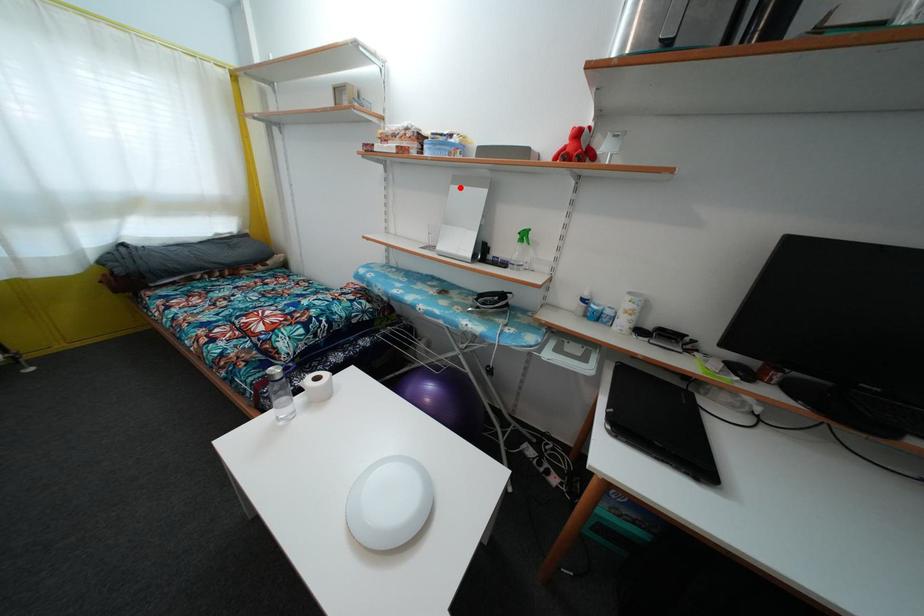
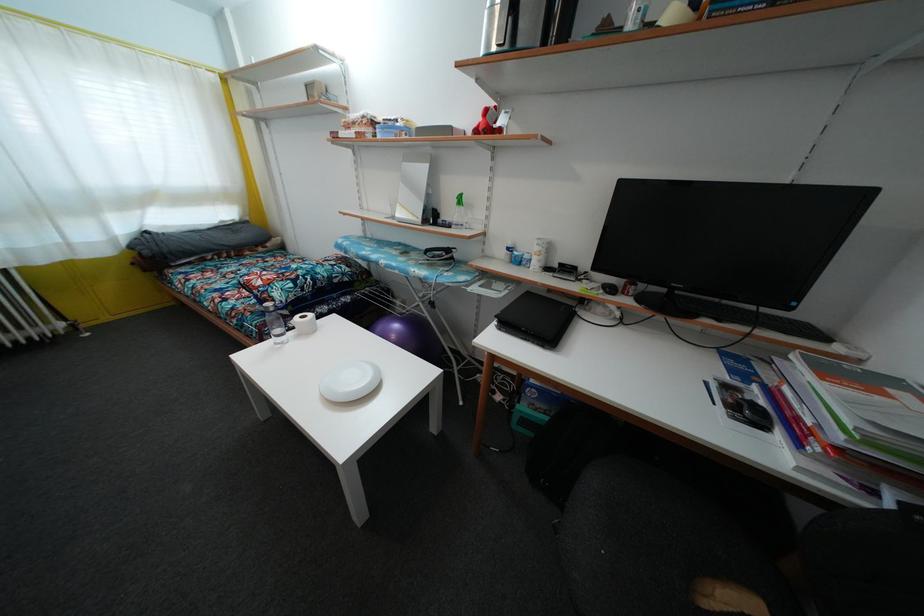
Where in the second image is the point corresponding to the highlighted location from the first image?

(410, 164)